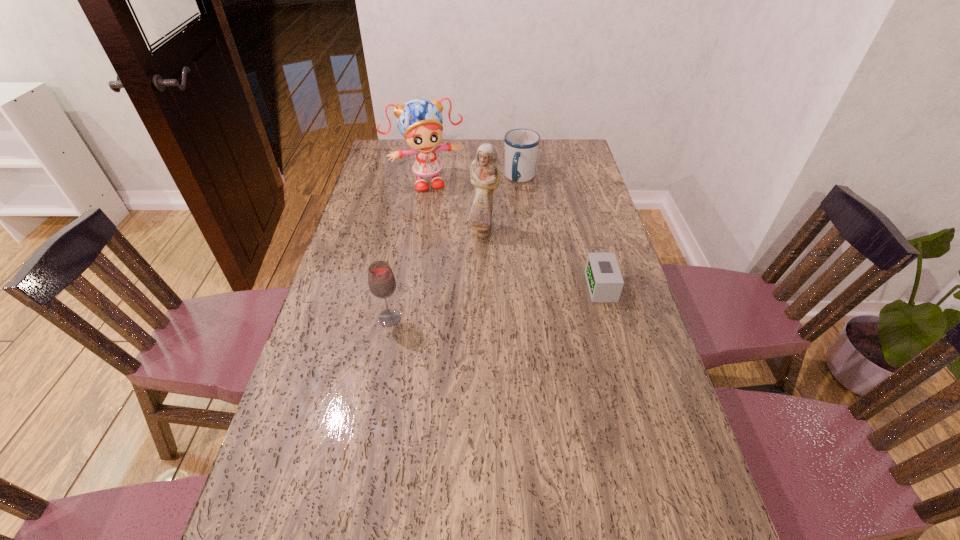
In order to click on vacant area situated 0.210m on the front-facing side of the figurine in this screenshot , I will do `click(508, 285)`.

Where is `object present at the far edge`? Image resolution: width=960 pixels, height=540 pixels. object present at the far edge is located at coordinates (521, 145).

The image size is (960, 540). Identify the location of glass drink container that is at the left edge. (381, 280).

Image resolution: width=960 pixels, height=540 pixels. What are the coordinates of `doll positioned at the left edge` in the screenshot? It's located at (419, 121).

Locate an element on the screen. The image size is (960, 540). object that is positioned at the right edge is located at coordinates (603, 276).

Find the location of `vacant region at the far edge of the desktop`. vacant region at the far edge of the desktop is located at coordinates (483, 143).

Where is `vacant space at the left edge of the desktop`? The height and width of the screenshot is (540, 960). vacant space at the left edge of the desktop is located at coordinates (383, 208).

In order to click on free region at the right edge of the desktop in this screenshot , I will do `click(587, 328)`.

Locate an element on the screen. The width and height of the screenshot is (960, 540). free region at the far left corner is located at coordinates (380, 148).

In the image, there is a desktop. Identify the location of free space at the far right corner. The height and width of the screenshot is (540, 960). (580, 159).